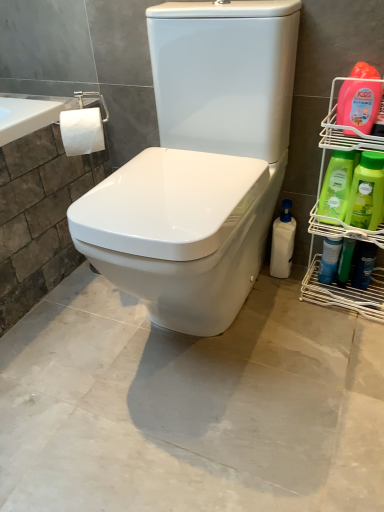
Question: Does green plastic bottles at right, which ranks as the 5th cleaning product in right-to-left order, have a smaller size compared to green plastic bottles at right?

Choices:
 (A) yes
 (B) no

Answer: (A)

Question: From the image's perspective, would you say green plastic bottles at right, placed as the second cleaning product when sorted from left to right, is positioned over green plastic bottles at right?

Choices:
 (A) no
 (B) yes

Answer: (B)

Question: Considering the relative sizes of green plastic bottles at right, placed as the second cleaning product when sorted from left to right, and green plastic bottles at right in the image provided, is green plastic bottles at right, placed as the second cleaning product when sorted from left to right, bigger than green plastic bottles at right?

Choices:
 (A) no
 (B) yes

Answer: (A)

Question: From the image's perspective, is green plastic bottles at right, which ranks as the 5th cleaning product in right-to-left order, located beneath green plastic bottles at right?

Choices:
 (A) no
 (B) yes

Answer: (A)

Question: Is green plastic bottles at right, which ranks as the 5th cleaning product in right-to-left order, looking in the opposite direction of green plastic bottles at right?

Choices:
 (A) yes
 (B) no

Answer: (A)

Question: Is green plastic bottles at right situated inside green matte bottle at right, which is counted as the fourth cleaning product, starting from the left, or outside?

Choices:
 (A) outside
 (B) inside

Answer: (A)

Question: In the image, is green plastic bottles at right on the left side or the right side of green matte bottle at right, which is counted as the fourth cleaning product, starting from the left?

Choices:
 (A) left
 (B) right

Answer: (A)

Question: Is green plastic bottles at right bigger or smaller than green matte bottle at right, arranged as the 3th cleaning product when viewed from the right?

Choices:
 (A) big
 (B) small

Answer: (A)

Question: In terms of width, does green plastic bottles at right look wider or thinner when compared to green matte bottle at right, arranged as the 3th cleaning product when viewed from the right?

Choices:
 (A) thin
 (B) wide

Answer: (B)

Question: From the image's perspective, is blue glossy spray bottle at right, arranged as the second cleaning product when viewed from the right, located above or below dark blue plastic can at lower right, acting as the first cleaning product starting from the right?

Choices:
 (A) above
 (B) below

Answer: (A)

Question: In terms of height, does blue glossy spray bottle at right, arranged as the 5th cleaning product when viewed from the left, look taller or shorter compared to dark blue plastic can at lower right, acting as the first cleaning product starting from the right?

Choices:
 (A) short
 (B) tall

Answer: (A)

Question: Considering the positions of point (352, 248) and point (359, 257), is point (352, 248) closer or farther from the camera than point (359, 257)?

Choices:
 (A) closer
 (B) farther

Answer: (A)

Question: Looking at the image, does blue glossy spray bottle at right, arranged as the second cleaning product when viewed from the right, seem bigger or smaller compared to dark blue plastic can at lower right, acting as the first cleaning product starting from the right?

Choices:
 (A) big
 (B) small

Answer: (B)

Question: Visually, is green plastic bottles at right, which ranks as the 5th cleaning product in right-to-left order, positioned to the left or to the right of green plastic bottles at right?

Choices:
 (A) left
 (B) right

Answer: (A)

Question: From the image's perspective, relative to green plastic bottles at right, is green plastic bottles at right, placed as the second cleaning product when sorted from left to right, above or below?

Choices:
 (A) below
 (B) above

Answer: (B)